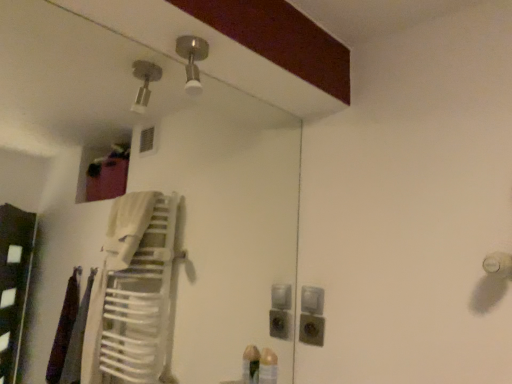
Question: Could satin silver switch at center be considered to be inside satin nickel light fixture at upper center?

Choices:
 (A) yes
 (B) no

Answer: (B)

Question: Does satin nickel light fixture at upper center have a lesser width compared to satin silver switch at center?

Choices:
 (A) yes
 (B) no

Answer: (B)

Question: Is the position of satin nickel light fixture at upper center less distant than that of satin silver switch at center?

Choices:
 (A) no
 (B) yes

Answer: (B)

Question: From the image's perspective, is satin nickel light fixture at upper center located above satin silver switch at center?

Choices:
 (A) yes
 (B) no

Answer: (A)

Question: Is satin nickel light fixture at upper center facing towards satin silver switch at center?

Choices:
 (A) no
 (B) yes

Answer: (A)

Question: Is matte gray outlet at lower center bigger or smaller than satin silver switch at center?

Choices:
 (A) small
 (B) big

Answer: (B)

Question: Would you say matte gray outlet at lower center is inside or outside satin silver switch at center?

Choices:
 (A) outside
 (B) inside

Answer: (A)

Question: Is matte gray outlet at lower center in front of or behind satin silver switch at center in the image?

Choices:
 (A) behind
 (B) front

Answer: (B)

Question: Is matte gray outlet at lower center to the left or to the right of satin silver switch at center in the image?

Choices:
 (A) left
 (B) right

Answer: (A)

Question: From their relative heights in the image, would you say satin silver switch at center is taller or shorter than satin nickel light fixture at upper center?

Choices:
 (A) short
 (B) tall

Answer: (A)

Question: Would you say satin silver switch at center is to the left or to the right of satin nickel light fixture at upper center in the picture?

Choices:
 (A) right
 (B) left

Answer: (A)

Question: From the image's perspective, is satin silver switch at center above or below satin nickel light fixture at upper center?

Choices:
 (A) above
 (B) below

Answer: (B)

Question: Do you think satin silver switch at center is within satin nickel light fixture at upper center, or outside of it?

Choices:
 (A) outside
 (B) inside

Answer: (A)

Question: Visually, is matte gray outlet at lower center positioned to the left or to the right of satin nickel light fixture at upper center?

Choices:
 (A) left
 (B) right

Answer: (B)

Question: Is matte gray outlet at lower center inside the boundaries of satin nickel light fixture at upper center, or outside?

Choices:
 (A) inside
 (B) outside

Answer: (B)